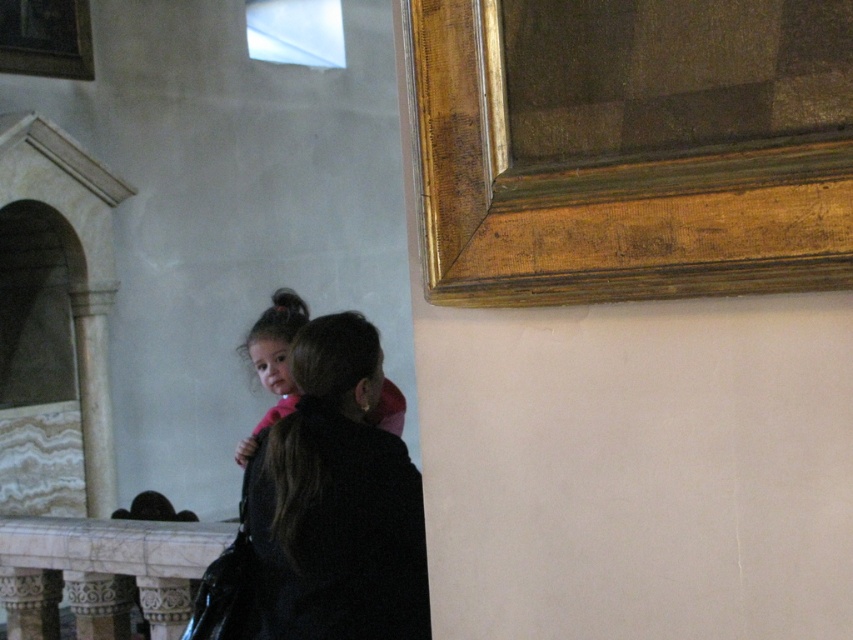
Can you confirm if white marble balustrade at lower left is positioned above gold textured frame at upper left?

No.

Image resolution: width=853 pixels, height=640 pixels. What do you see at coordinates (102, 572) in the screenshot? I see `white marble balustrade at lower left` at bounding box center [102, 572].

This screenshot has width=853, height=640. In order to click on white marble balustrade at lower left in this screenshot , I will do `click(102, 572)`.

Does gold wood picture frame at upper right have a smaller size compared to pink fabric at center?

Yes, gold wood picture frame at upper right is smaller than pink fabric at center.

Measure the distance between gold wood picture frame at upper right and pink fabric at center.

gold wood picture frame at upper right is 4.79 feet from pink fabric at center.

Describe the element at coordinates (631, 147) in the screenshot. I see `gold wood picture frame at upper right` at that location.

Identify the location of gold wood picture frame at upper right. (631, 147).

Which is above, gold textured frame at upper left or pink fabric at center?

Positioned higher is gold textured frame at upper left.

Which is in front, point (48, 68) or point (374, 412)?

Point (374, 412) is in front.

I want to click on gold textured frame at upper left, so click(45, 36).